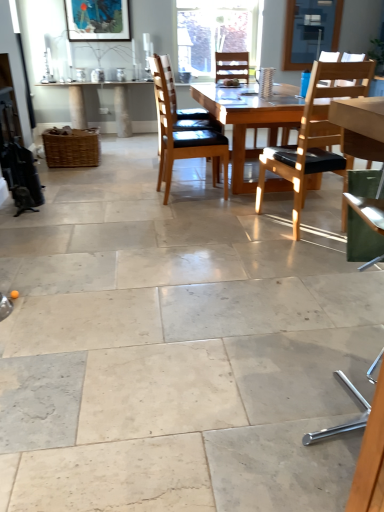
What do you see at coordinates (368, 210) in the screenshot? This screenshot has width=384, height=512. I see `green fabric chair at right, which is the second chair in left-to-right order` at bounding box center [368, 210].

Describe the element at coordinates (249, 121) in the screenshot. I see `wooden table at center` at that location.

This screenshot has height=512, width=384. I want to click on wooden table at center, so click(x=249, y=121).

The height and width of the screenshot is (512, 384). Describe the element at coordinates (310, 31) in the screenshot. I see `transparent glass window screen at upper center` at that location.

Measure the distance between point (257,31) and camera.

The distance of point (257,31) from camera is 6.14 meters.

Find the location of a particular element. The height and width of the screenshot is (512, 384). green fabric chair at right, the 1th chair positioned from the front is located at coordinates pos(368,210).

Which is closer to the camera, (x=370, y=211) or (x=297, y=35)?

The point (x=370, y=211) is closer to the camera.

Identify the location of the 3rd chair positioned below the transparent glass window screen at upper center (from a real-world perspective). (368, 210).

Based on the photo, is green fabric chair at right, the 1th chair positioned from the front, to the right of transparent glass window screen at upper center from the viewer's perspective?

No, green fabric chair at right, the 1th chair positioned from the front, is not to the right of transparent glass window screen at upper center.

Looking at their sizes, would you say green fabric chair at right, positioned as the 2th chair in right-to-left order, is wider or thinner than transparent glass window screen at upper center?

Clearly, green fabric chair at right, positioned as the 2th chair in right-to-left order, has more width compared to transparent glass window screen at upper center.

From the picture: In terms of size, does wooden table at center appear bigger or smaller than transparent glass window screen at upper center?

wooden table at center is bigger than transparent glass window screen at upper center.

Between wooden table at center and transparent glass window screen at upper center, which one has smaller width?

transparent glass window screen at upper center is thinner.

From a real-world perspective, which object stands above the other?

In real-world perspective, transparent glass window screen at upper center is above.

Is wooden table at center facing towards transparent glass window screen at upper center?

No.

Is brown leather chair at center, the third chair when ordered from right to left, facing away from light brown wood chair at center right, which is the 3th chair from left to right?

No, brown leather chair at center, the third chair when ordered from right to left,'s orientation is not away from light brown wood chair at center right, which is the 3th chair from left to right.

Who is smaller, brown leather chair at center, which is the 1th chair in back-to-front order, or light brown wood chair at center right, which is the first chair in right-to-left order?

Smaller between the two is brown leather chair at center, which is the 1th chair in back-to-front order.

Can you tell me how much brown leather chair at center, which ranks as the third chair in front-to-back order, and light brown wood chair at center right, which is the first chair in right-to-left order, differ in facing direction?

They differ by 98 degrees in their facing directions.

Can you confirm if brown leather chair at center, which is the 1th chair in back-to-front order, is taller than light brown wood chair at center right, positioned as the second chair in front-to-back order?

Incorrect, the height of brown leather chair at center, which is the 1th chair in back-to-front order, is not larger of that of light brown wood chair at center right, positioned as the second chair in front-to-back order.

From the image's perspective, which one is positioned lower, transparent glass window screen at upper center or brown leather chair at center, the third chair when ordered from right to left?

brown leather chair at center, the third chair when ordered from right to left.

Would you say brown leather chair at center, which ranks as the third chair in front-to-back order, is part of transparent glass window screen at upper center's contents?

No, brown leather chair at center, which ranks as the third chair in front-to-back order, is not a part of transparent glass window screen at upper center.

Find the location of a particular element. The width and height of the screenshot is (384, 512). window screen above the brown leather chair at center, which is the 1th chair in back-to-front order (from a real-world perspective) is located at coordinates (310, 31).

Is transparent glass window screen at upper center oriented away from brown leather chair at center, which is the 1th chair in back-to-front order?

No, transparent glass window screen at upper center is not facing away from brown leather chair at center, which is the 1th chair in back-to-front order.

In the image, is brown leather chair at center, which ranks as the third chair in front-to-back order, on the left side or the right side of transparent glass window screen at upper center?

Clearly, brown leather chair at center, which ranks as the third chair in front-to-back order, is on the left of transparent glass window screen at upper center in the image.

Considering the positions of point (195, 157) and point (311, 10), is point (195, 157) closer or farther from the camera than point (311, 10)?

Point (195, 157) is positioned closer to the camera compared to point (311, 10).

Can you tell me how much brown leather chair at center, which ranks as the third chair in front-to-back order, and transparent glass window screen at upper center differ in facing direction?

94.7 degrees.

Identify the location of window screen that appears behind the brown leather chair at center, the third chair when ordered from right to left. The image size is (384, 512). (310, 31).

Considering the sizes of wooden table at center and matte wooden picture frame at upper center in the image, is wooden table at center wider or thinner than matte wooden picture frame at upper center?

In the image, wooden table at center appears to be wider than matte wooden picture frame at upper center.

Is wooden table at center facing towards matte wooden picture frame at upper center?

No, wooden table at center is not turned towards matte wooden picture frame at upper center.

Are wooden table at center and matte wooden picture frame at upper center located far from each other?

Yes.

Where is `kitchen & dining room table below the matte wooden picture frame at upper center (from a real-world perspective)`? This screenshot has width=384, height=512. kitchen & dining room table below the matte wooden picture frame at upper center (from a real-world perspective) is located at coordinates (249, 121).

Based on the photo, does matte wooden picture frame at upper center touch light brown wood chair at center right, which is the 3th chair from left to right?

matte wooden picture frame at upper center and light brown wood chair at center right, which is the 3th chair from left to right, are clearly separated.

From the image's perspective, who appears lower, matte wooden picture frame at upper center or light brown wood chair at center right, which is the 3th chair from left to right?

light brown wood chair at center right, which is the 3th chair from left to right.

Is point (119, 26) less distant than point (307, 105)?

No.

Identify the location of window screen located above the green fabric chair at right, positioned as the 2th chair in right-to-left order (from the image's perspective). The image size is (384, 512). (310, 31).

What are the coordinates of `window screen located on the right of wooden table at center` in the screenshot? It's located at (310, 31).

In the scene shown: Which object lies nearer to the anchor point green fabric chair at right, the 1th chair positioned from the front, brown leather chair at center, acting as the 1th chair starting from the left, or matte wooden picture frame at upper center?

brown leather chair at center, acting as the 1th chair starting from the left, is positioned closer to the anchor green fabric chair at right, the 1th chair positioned from the front.

Considering their positions, is transparent glass window at upper center positioned further to light brown wood chair at center right, which is the first chair in right-to-left order, than matte wooden picture frame at upper center?

matte wooden picture frame at upper center is further to light brown wood chair at center right, which is the first chair in right-to-left order.

Estimate the real-world distances between objects in this image. Which object is closer to transparent glass window at upper center, wooden table at center or transparent glass window screen at upper center?

Among the two, transparent glass window screen at upper center is located nearer to transparent glass window at upper center.

Which object lies further to the anchor point light brown wood chair at center right, which is the first chair in right-to-left order, green fabric chair at right, positioned as the 2th chair in right-to-left order, or transparent glass window at upper center?

Among the two, transparent glass window at upper center is located further to light brown wood chair at center right, which is the first chair in right-to-left order.

Estimate the real-world distances between objects in this image. Which object is closer to light brown wood chair at center right, positioned as the second chair in front-to-back order, transparent glass window screen at upper center or green fabric chair at right, the 1th chair positioned from the front?

green fabric chair at right, the 1th chair positioned from the front, is positioned closer to the anchor light brown wood chair at center right, positioned as the second chair in front-to-back order.

Estimate the real-world distances between objects in this image. Which object is further from transparent glass window at upper center, green fabric chair at right, which is the second chair in left-to-right order, or matte wooden picture frame at upper center?

green fabric chair at right, which is the second chair in left-to-right order.

In the scene shown: Based on their spatial positions, is transparent glass window screen at upper center or light brown wood chair at center right, positioned as the second chair in front-to-back order, closer to matte wooden picture frame at upper center?

Based on the image, transparent glass window screen at upper center appears to be nearer to matte wooden picture frame at upper center.

Based on their spatial positions, is transparent glass window at upper center or brown leather chair at center, which ranks as the third chair in front-to-back order, further from light brown wood chair at center right, which is the 3th chair from left to right?

transparent glass window at upper center.

You are a GUI agent. You are given a task and a screenshot of the screen. Output one action in this format:
    pyautogui.click(x=<x>, y=<y>)
    Task: Click on the kitchen & dining room table between brown leather chair at center, the third chair when ordered from right to left, and light brown wood chair at center right, which is the first chair in right-to-left order, from left to right
    
    Given the screenshot: What is the action you would take?
    pyautogui.click(x=249, y=121)

Identify the location of window screen located between wooden table at center and transparent glass window at upper center in the depth direction. (310, 31).

This screenshot has height=512, width=384. Find the location of `picture frame between wooden table at center and transparent glass window at upper center from front to back`. picture frame between wooden table at center and transparent glass window at upper center from front to back is located at coordinates (97, 20).

Identify the location of kitchen & dining room table between matte wooden picture frame at upper center and transparent glass window screen at upper center. This screenshot has height=512, width=384. (249, 121).